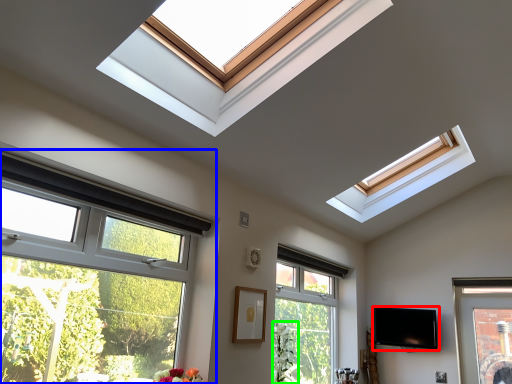
Question: Considering the real-world distances, which object is farthest from television (highlighted by a red box)? window (highlighted by a blue box) or plant (highlighted by a green box)?

Choices:
 (A) window
 (B) plant

Answer: (A)